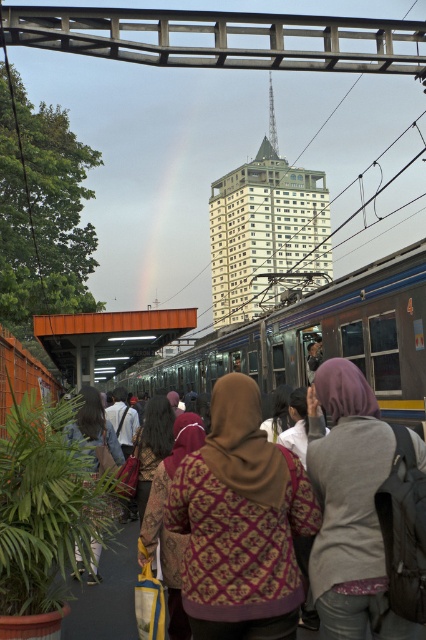
You are standing on the platform and want to board the metallic silver train at center. There is a person wearing a gray fleece jacket at center blocking your path. Which direction should you move to avoid them and reach the train?

You should move to the right of the gray fleece jacket at center because the metallic silver train at center is located to the left of them, so moving right will allow you to bypass the person and head towards the train.

Based on the photo, you are a passenger waiting at the train station platform. You notice a patterned fabric headscarf at center and a metallic silver train at center. Which object is positioned higher from the ground?

The patterned fabric headscarf at center is above metallic silver train at center, so the patterned fabric headscarf at center is positioned higher from the ground.

You are a photographer trying to capture both the patterned fabric headscarf at center and the metallic silver train at center in a single shot. Which object should you focus on first if you want to ensure both are in clear focus?

You should focus on the metallic silver train at center first because it is thicker than the patterned fabric headscarf at center, so focusing on the thicker object will help ensure both are in focus.